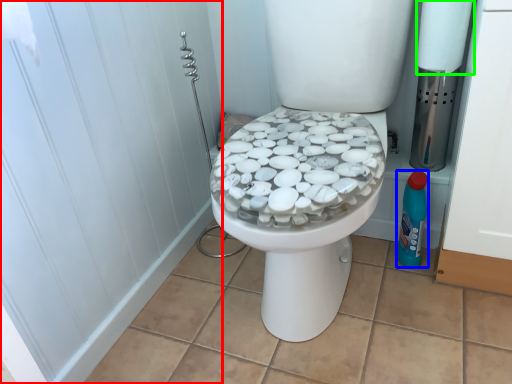
Question: Which object is positioned farthest from screen door (highlighted by a red box)? Select from cleaning product (highlighted by a blue box) and toilet paper (highlighted by a green box).

Choices:
 (A) cleaning product
 (B) toilet paper

Answer: (B)